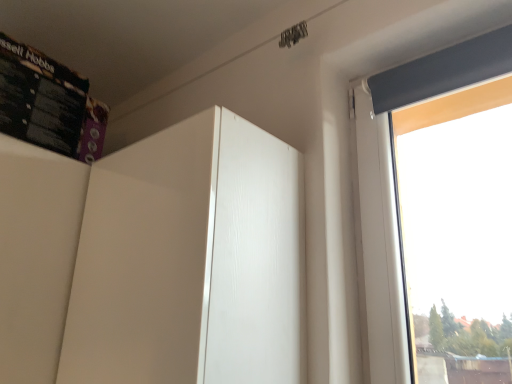
Question: Is black cardboard box at upper left taller than white glossy cabinet at center?

Choices:
 (A) yes
 (B) no

Answer: (B)

Question: Does black cardboard box at upper left appear on the left side of white glossy cabinet at center?

Choices:
 (A) yes
 (B) no

Answer: (A)

Question: Does black cardboard box at upper left lie in front of white glossy cabinet at center?

Choices:
 (A) yes
 (B) no

Answer: (B)

Question: Does black cardboard box at upper left have a lesser width compared to white glossy cabinet at center?

Choices:
 (A) no
 (B) yes

Answer: (A)

Question: Is black cardboard box at upper left placed right next to white glossy cabinet at center?

Choices:
 (A) yes
 (B) no

Answer: (B)

Question: From the image's perspective, does black cardboard box at upper left appear lower than white glossy cabinet at center?

Choices:
 (A) yes
 (B) no

Answer: (B)

Question: From a real-world perspective, is white glossy cabinet at center positioned under black cardboard box at upper left based on gravity?

Choices:
 (A) yes
 (B) no

Answer: (A)

Question: Is white glossy cabinet at center further to the viewer compared to black cardboard box at upper left?

Choices:
 (A) no
 (B) yes

Answer: (A)

Question: Is white glossy cabinet at center placed right next to black cardboard box at upper left?

Choices:
 (A) no
 (B) yes

Answer: (A)

Question: Does white glossy cabinet at center turn towards black cardboard box at upper left?

Choices:
 (A) no
 (B) yes

Answer: (A)

Question: Does white glossy cabinet at center have a lesser width compared to black cardboard box at upper left?

Choices:
 (A) yes
 (B) no

Answer: (A)

Question: Considering the relative sizes of white glossy cabinet at center and black cardboard box at upper left in the image provided, is white glossy cabinet at center smaller than black cardboard box at upper left?

Choices:
 (A) yes
 (B) no

Answer: (B)

Question: Is white glossy cabinet at center wider or thinner than black cardboard box at upper left?

Choices:
 (A) wide
 (B) thin

Answer: (B)